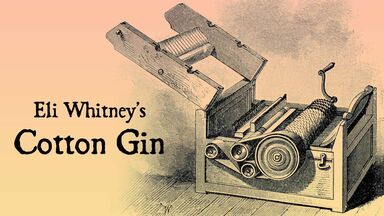
I want to click on box, so click(x=210, y=175), click(x=307, y=181), click(x=356, y=140), click(x=230, y=111).